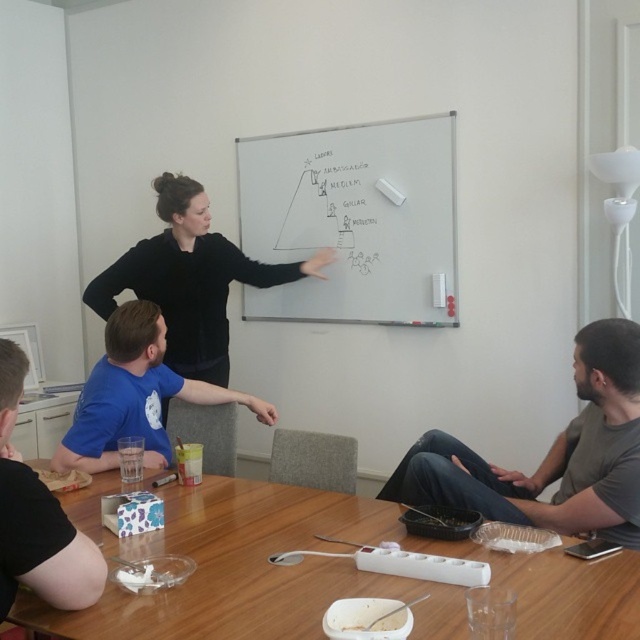
Question: Among these points, which one is nearest to the camera?

Choices:
 (A) (164, 600)
 (B) (108, 390)

Answer: (A)

Question: Can you confirm if whiteboard at upper center is thinner than black matte/blackboard at upper center?

Choices:
 (A) yes
 (B) no

Answer: (A)

Question: Is the position of black matte/blackboard at upper center more distant than that of blue t-shirt at lower left?

Choices:
 (A) yes
 (B) no

Answer: (A)

Question: Where is black matte/blackboard at upper center located in relation to blue t-shirt at center in the image?

Choices:
 (A) left
 (B) right

Answer: (B)

Question: Which of the following is the farthest from the observer?

Choices:
 (A) dark gray jeans at lower right
 (B) whiteboard at upper center

Answer: (B)

Question: Among these points, which one is farthest from the camera?

Choices:
 (A) (301, 228)
 (B) (4, 426)
 (C) (484, 492)
 (D) (180, 227)

Answer: (A)